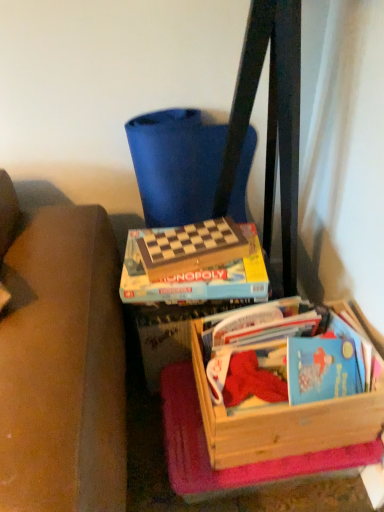
Question: Looking at the image, does blue fabric folding chair at upper center seem bigger or smaller compared to wooden crate at lower right?

Choices:
 (A) big
 (B) small

Answer: (A)

Question: From their relative heights in the image, would you say blue fabric folding chair at upper center is taller or shorter than wooden crate at lower right?

Choices:
 (A) tall
 (B) short

Answer: (A)

Question: Which object is positioned closest to the wooden paperback book at center?

Choices:
 (A) blue fabric folding chair at upper center
 (B) wooden crate at lower right

Answer: (A)

Question: Which object is positioned closest to the wooden crate at lower right?

Choices:
 (A) wooden paperback book at center
 (B) blue fabric folding chair at upper center

Answer: (A)